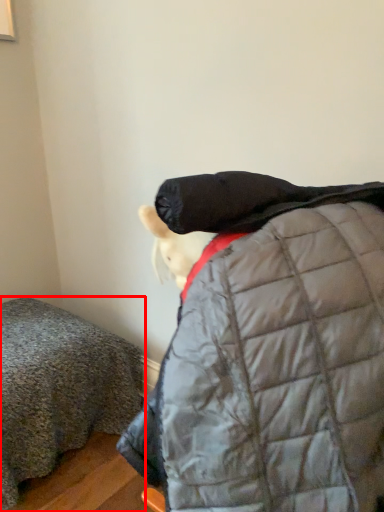
Question: From the image's perspective, considering the relative positions of furniture (annotated by the red box) and jacket in the image provided, where is furniture (annotated by the red box) located with respect to the staircase?

Choices:
 (A) above
 (B) below

Answer: (A)